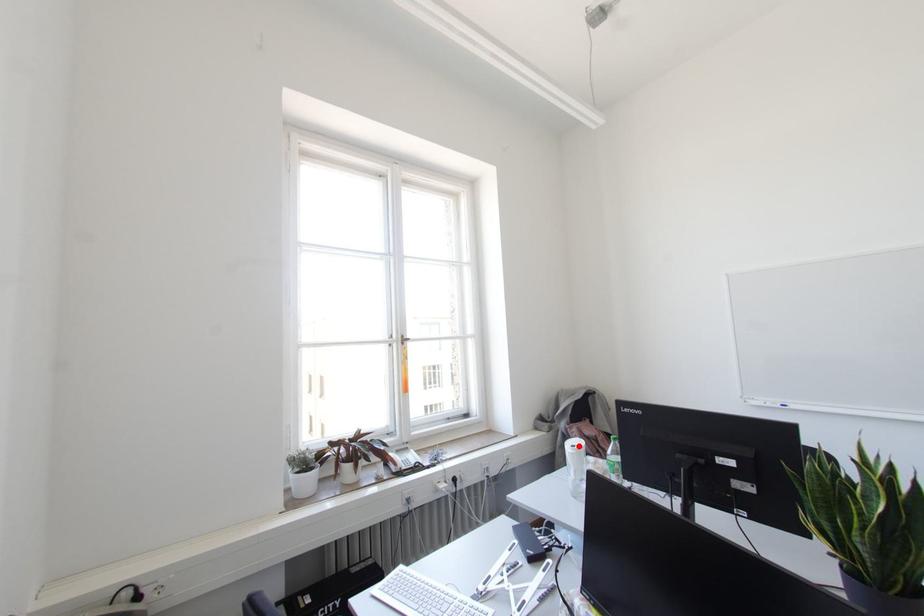
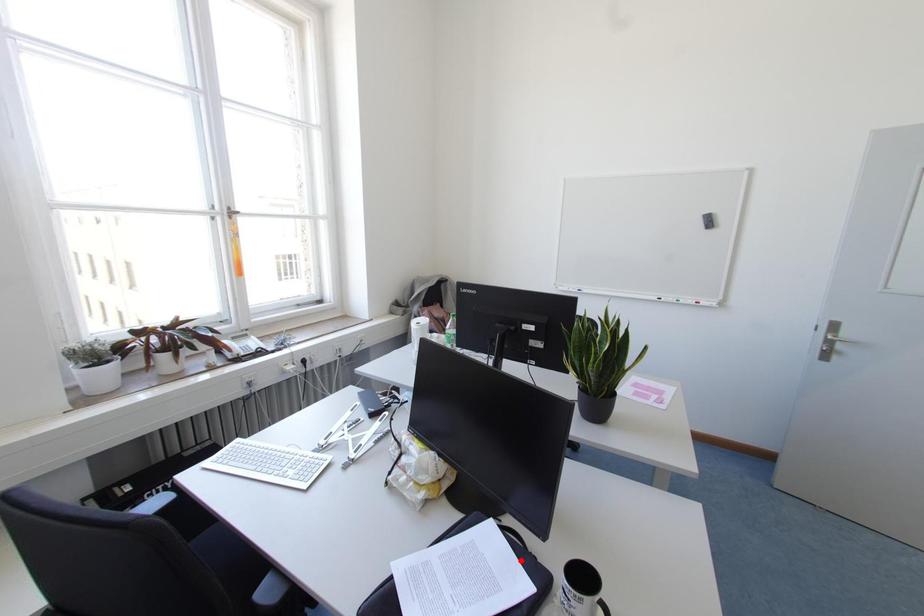
I am providing you with two images of the same scene from different viewpoints. A red point is marked on the first image and another point is marked on the second image. Is the red point in image1 aligned with the point shown in image2?

No